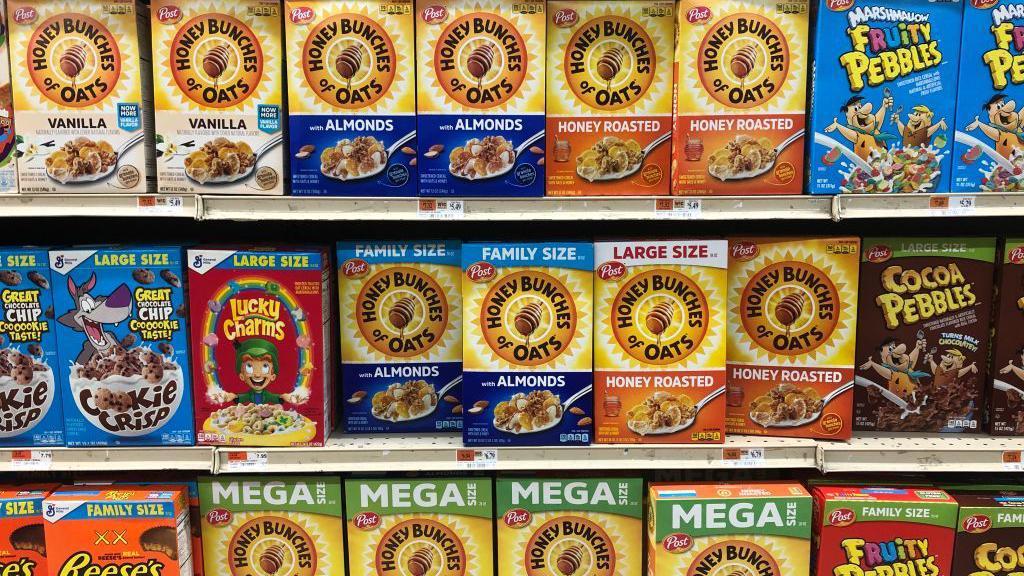
In order to click on shelf price tags in this screenshot , I will do `click(154, 204)`, `click(441, 206)`, `click(681, 200)`, `click(947, 203)`, `click(1011, 453)`, `click(743, 452)`, `click(482, 452)`, `click(240, 453)`, `click(33, 449)`.